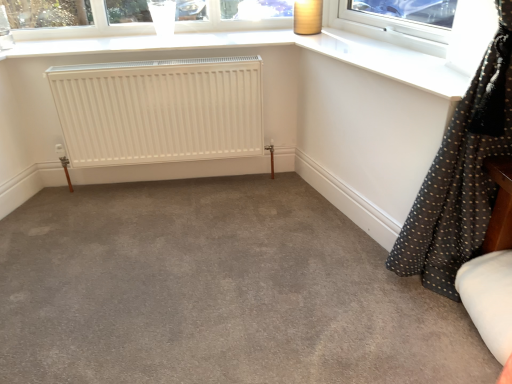
Question: Considering the relative positions of white matte radiator at center and matte brown lampshade at upper right in the image provided, is white matte radiator at center to the right of matte brown lampshade at upper right from the viewer's perspective?

Choices:
 (A) yes
 (B) no

Answer: (B)

Question: Is white matte radiator at center positioned behind matte brown lampshade at upper right?

Choices:
 (A) yes
 (B) no

Answer: (B)

Question: Considering the relative sizes of white matte radiator at center and matte brown lampshade at upper right in the image provided, is white matte radiator at center thinner than matte brown lampshade at upper right?

Choices:
 (A) yes
 (B) no

Answer: (A)

Question: Considering the relative sizes of white matte radiator at center and matte brown lampshade at upper right in the image provided, is white matte radiator at center smaller than matte brown lampshade at upper right?

Choices:
 (A) yes
 (B) no

Answer: (B)

Question: Is white matte radiator at center far away from matte brown lampshade at upper right?

Choices:
 (A) no
 (B) yes

Answer: (A)

Question: In terms of height, does gray carpet at center look taller or shorter compared to clear glass window at upper center?

Choices:
 (A) short
 (B) tall

Answer: (A)

Question: Considering the positions of gray carpet at center and clear glass window at upper center in the image, is gray carpet at center bigger or smaller than clear glass window at upper center?

Choices:
 (A) small
 (B) big

Answer: (B)

Question: Considering the relative positions of gray carpet at center and clear glass window at upper center in the image provided, is gray carpet at center to the left or to the right of clear glass window at upper center?

Choices:
 (A) right
 (B) left

Answer: (A)

Question: Does point (110, 342) appear closer or farther from the camera than point (274, 21)?

Choices:
 (A) closer
 (B) farther

Answer: (A)

Question: Would you say black dotted fabric at right is to the left or to the right of matte brown lampshade at upper right in the picture?

Choices:
 (A) left
 (B) right

Answer: (B)

Question: From the image's perspective, is black dotted fabric at right positioned above or below matte brown lampshade at upper right?

Choices:
 (A) below
 (B) above

Answer: (A)

Question: From a real-world perspective, is black dotted fabric at right above or below matte brown lampshade at upper right?

Choices:
 (A) above
 (B) below

Answer: (B)

Question: Is point (451, 142) closer or farther from the camera than point (305, 18)?

Choices:
 (A) farther
 (B) closer

Answer: (B)

Question: Looking at the image, does clear glass window at upper center seem bigger or smaller compared to white matte radiator at center?

Choices:
 (A) small
 (B) big

Answer: (A)

Question: Considering the positions of point (101, 21) and point (68, 150), is point (101, 21) closer or farther from the camera than point (68, 150)?

Choices:
 (A) closer
 (B) farther

Answer: (B)